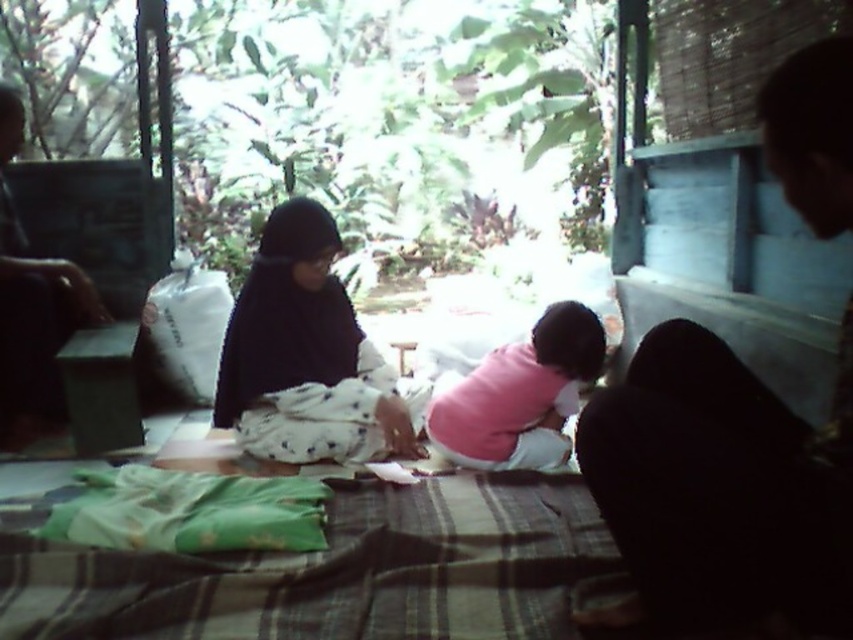
Question: Based on their relative distances, which object is farther from the black fabric at right?

Choices:
 (A) pink soft fabric baby at center
 (B) black fabric at center
 (C) green plaid blanket at lower center

Answer: (B)

Question: Does green plaid blanket at lower center appear on the left side of black fabric at right?

Choices:
 (A) no
 (B) yes

Answer: (B)

Question: Estimate the real-world distances between objects in this image. Which object is farther from the green plaid blanket at lower center?

Choices:
 (A) black fabric at right
 (B) black fabric at center

Answer: (B)

Question: Is green plaid blanket at lower center thinner than black fabric at right?

Choices:
 (A) yes
 (B) no

Answer: (B)

Question: Is black fabric at right wider than black fabric at center?

Choices:
 (A) yes
 (B) no

Answer: (B)

Question: Among these objects, which one is farthest from the camera?

Choices:
 (A) pink soft fabric baby at center
 (B) green plaid blanket at lower center
 (C) black fabric at center
 (D) black fabric at right

Answer: (C)